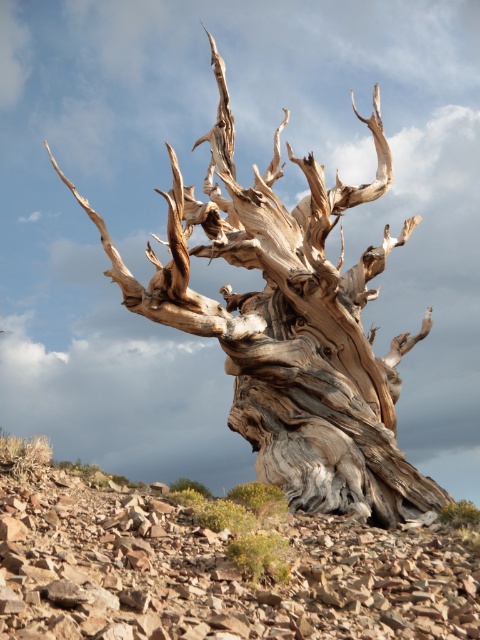
Question: Which point is closer to the camera?

Choices:
 (A) (197, 490)
 (B) (227, 116)

Answer: (A)

Question: Which object appears farthest from the camera in this image?

Choices:
 (A) gray rough bark tree at lower center
 (B) gray textured wood at center

Answer: (B)

Question: Does gray textured wood at center have a smaller size compared to gray rough bark tree at lower center?

Choices:
 (A) yes
 (B) no

Answer: (A)

Question: Can you confirm if gray textured wood at center is smaller than gray rough bark tree at lower center?

Choices:
 (A) no
 (B) yes

Answer: (B)

Question: Is gray textured wood at center further to the viewer compared to gray rough bark tree at lower center?

Choices:
 (A) no
 (B) yes

Answer: (B)